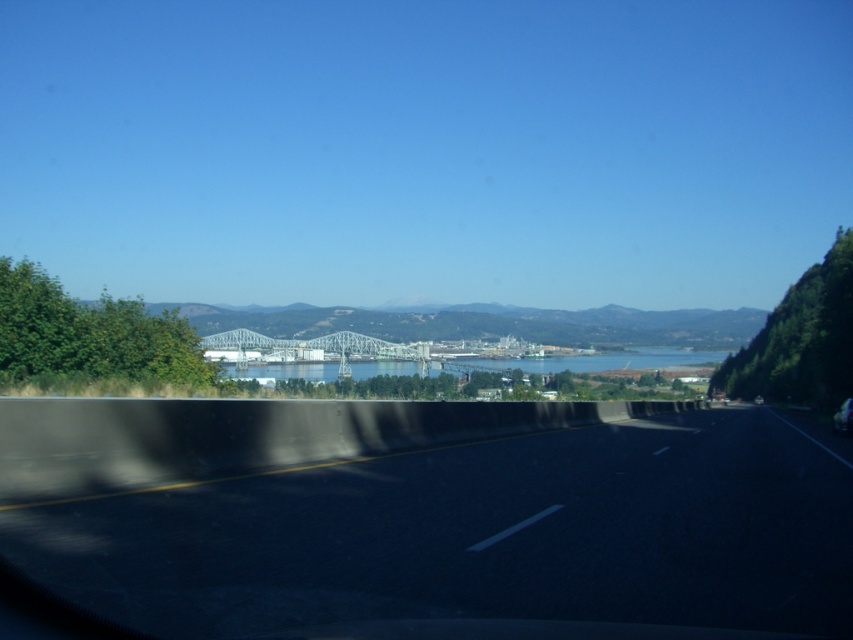
You are a driver in a car that is 18 feet long. You are currently on the black asphalt highway at center and see the metallic silver car at center ahead of you. What is the minimum safe following distance you should maintain in feet?

→ The black asphalt highway at center and metallic silver car at center are 48.70 feet apart. Since your car is 18 feet long, the minimum safe following distance should be at least 2 times your car length, which is 36 feet. However, the current distance is 48.70 feet, which is sufficient and safe.

You are a GPS navigator trying to determine the exact position of the black asphalt highway at center in the image. According to the coordinates provided, what are the x and y values of its location?

The black asphalt highway at center is located at point with x value 0.806 and y value 0.498.

You are a passenger in a car driving on the black asphalt highway at center. You look out the window and see the blue water at center in the distance. Which object takes up more space in your view?

The blue water at center takes up more space in the view because the black asphalt highway at center occupies less space than blue water at center according to the description.